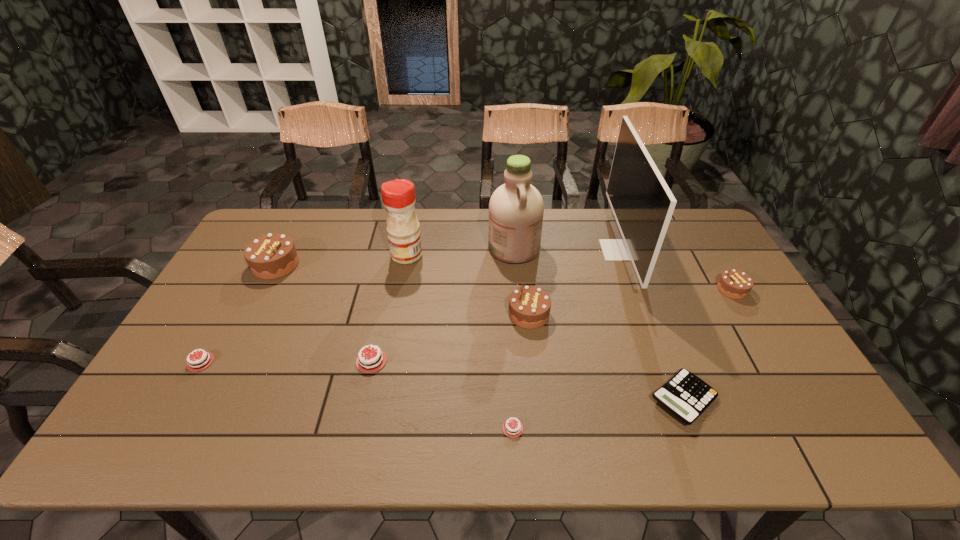
The image size is (960, 540). Identify the location of the second red chocolate cake from right to left. (368, 362).

This screenshot has height=540, width=960. Find the location of `the seventh tallest object`. the seventh tallest object is located at coordinates (368, 362).

Locate an element on the screen. The height and width of the screenshot is (540, 960). the fifth tallest chocolate cake is located at coordinates (201, 361).

Image resolution: width=960 pixels, height=540 pixels. In order to click on the leftmost red chocolate cake in this screenshot , I will do `click(201, 361)`.

Locate an element on the screen. The image size is (960, 540). calculator is located at coordinates (685, 395).

At what (x,y) coordinates should I click in order to perform the action: click on the shortest chocolate cake. Please return your answer as a coordinate pair (x, y). The width and height of the screenshot is (960, 540). Looking at the image, I should click on (512, 428).

At what (x,y) coordinates should I click in order to perform the action: click on the smallest red chocolate cake. Please return your answer as a coordinate pair (x, y). Looking at the image, I should click on (512, 428).

I want to click on free space located on the front-facing side of the monitor, so click(496, 250).

Locate an element on the screen. This screenshot has width=960, height=540. free space located 0.180m on the front-facing side of the monitor is located at coordinates (549, 250).

Locate an element on the screen. The height and width of the screenshot is (540, 960). vacant region located 0.070m on the front-facing side of the monitor is located at coordinates (582, 250).